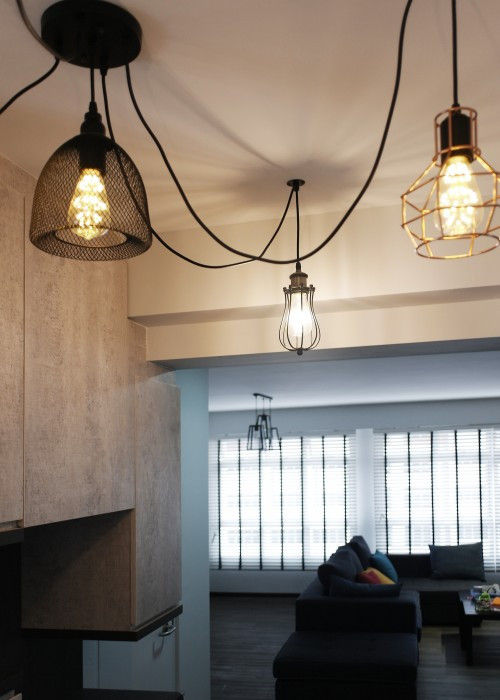
The height and width of the screenshot is (700, 500). In order to click on black cord in this screenshot , I will do `click(364, 187)`, `click(187, 260)`.